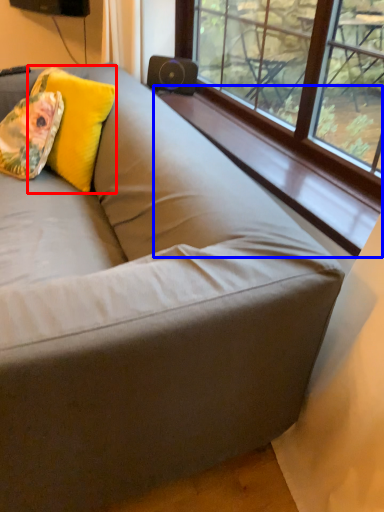
Question: Which object is closer to the camera taking this photo, throw pillow (highlighted by a red box) or window sill (highlighted by a blue box)?

Choices:
 (A) throw pillow
 (B) window sill

Answer: (B)